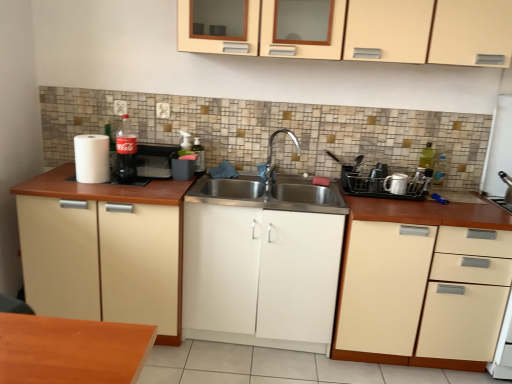
Identify the location of vacant space to the right of matte glass coca-cola bottle at left, which is counted as the 2th bottle, starting from the back. The image size is (512, 384). pos(157,187).